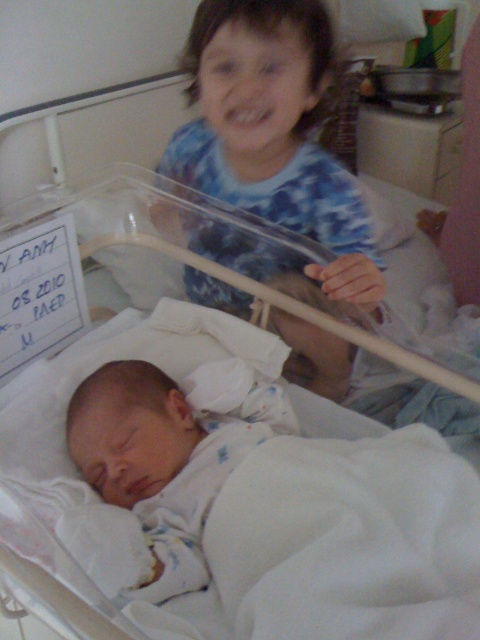
You are a nurse in the hospital room and need to place a small toy between the two points marked as point (268, 68) and point (213, 467). Which point is closer to you so you can place the toy correctly?

Point (268, 68) is closer to you than point (213, 467), so you should place the toy near that point first.

You are a nurse in a hospital room. You need to place a new medical device on the wall directly above the white fabric infant bed at center. According to the coordinates provided, where should you place the device?

The white fabric infant bed at center is located at coordinates point (343, 534). Therefore, the medical device should be placed directly above this point on the wall.

You are a nurse in a hospital room with a newborn baby. You need to ensure the baby stays warm during their nap. The white fabric infant bed at center and the white soft newborn at center are both present. Which object is bigger and can provide more space for covering the baby with a blanket?

The white fabric infant bed at center is larger in size than the white soft newborn at center, so it can provide more space for covering the baby with a blanket.